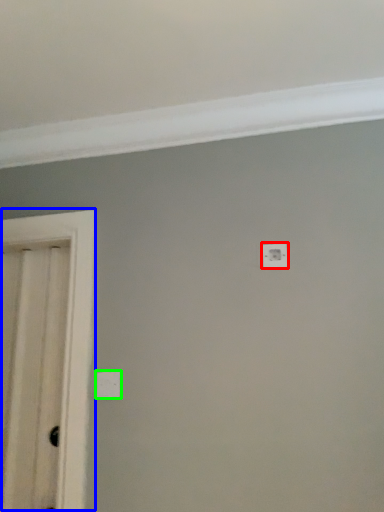
Question: Which object is positioned closest to light switch (highlighted by a red box)? Select from door (highlighted by a blue box) and light switch (highlighted by a green box).

Choices:
 (A) door
 (B) light switch

Answer: (B)